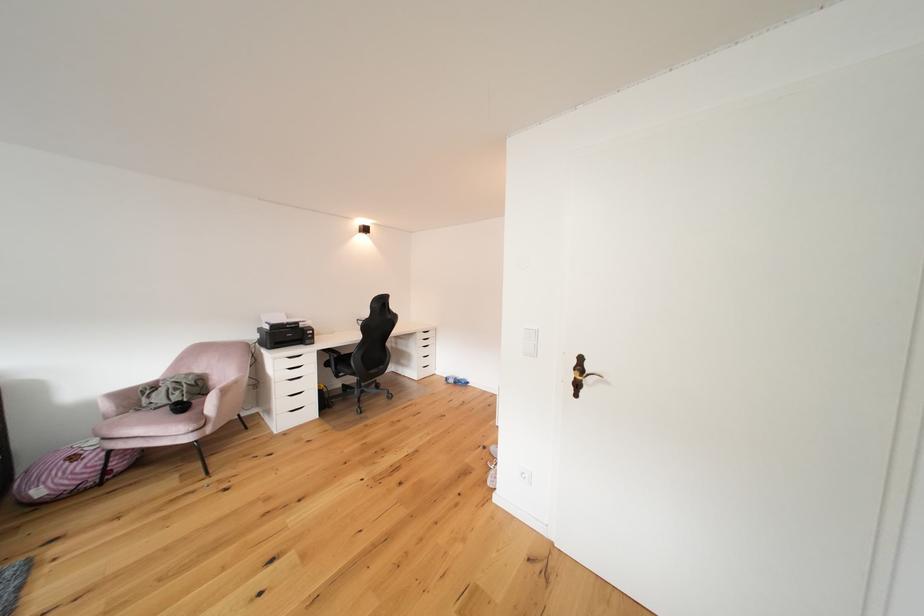
Where would you sit the pink chair sitting surface? Please return your answer as a coordinate pair (x, y).

(152, 423)